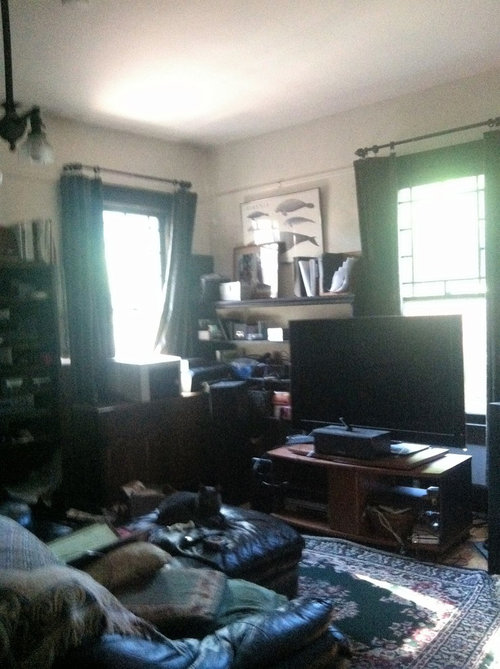
Find the location of a particular element. chandelier is located at coordinates (13, 130).